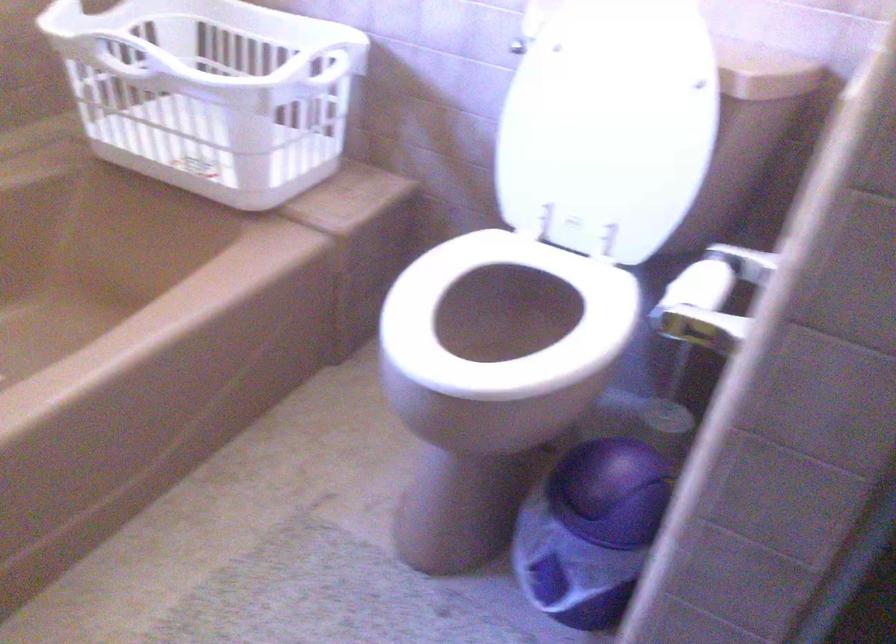
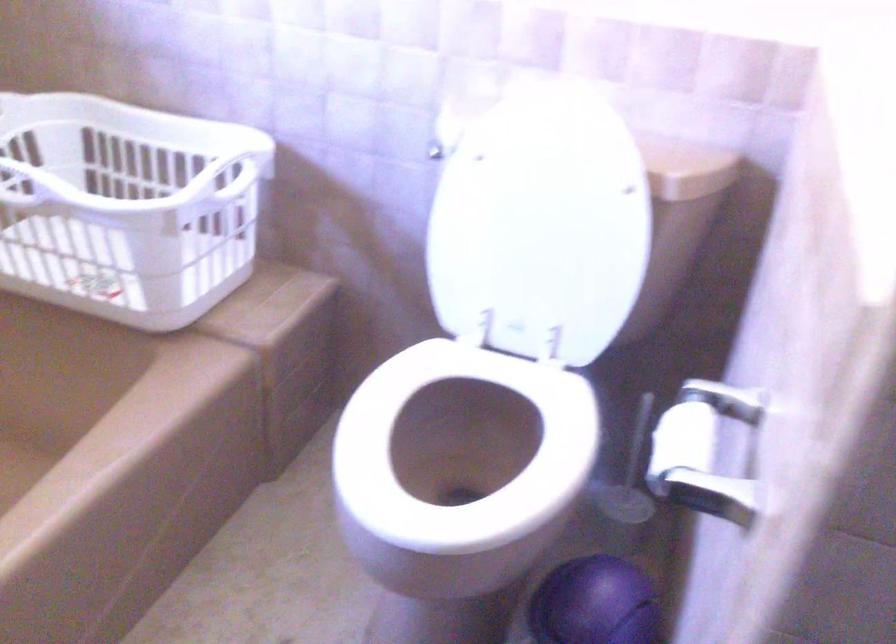
Question: Based on the continuous images, in which direction is the camera rotating? Reply with the corresponding letter.

Choices:
 (A) Left
 (B) Right
 (C) Up
 (D) Down

Answer: (B)